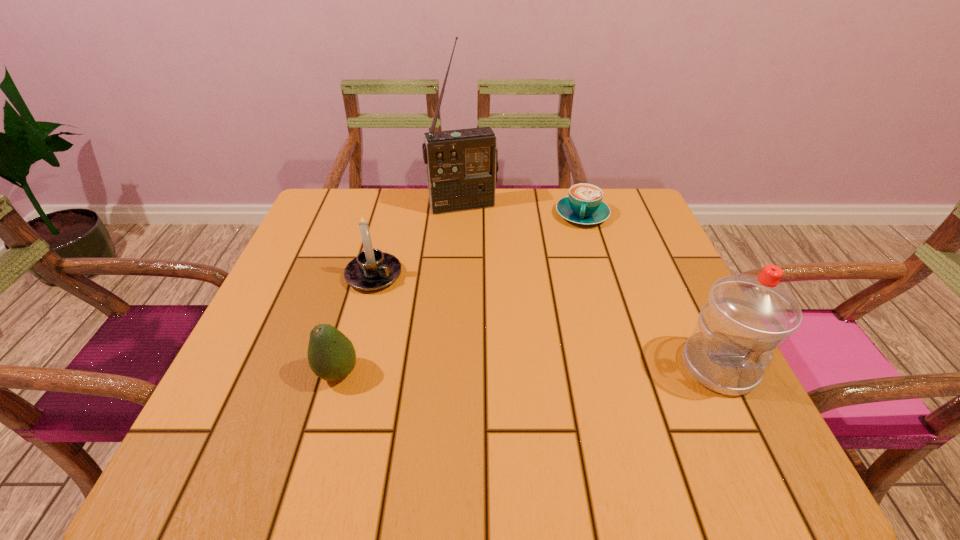
The width and height of the screenshot is (960, 540). In order to click on radio receiver that is at the far edge in this screenshot , I will do `click(462, 165)`.

Identify the location of avocado that is at the near edge. (331, 355).

The image size is (960, 540). Find the location of `water bottle located in the near edge section of the desktop`. water bottle located in the near edge section of the desktop is located at coordinates (746, 317).

Where is `avocado present at the left edge`? avocado present at the left edge is located at coordinates (331, 355).

At what (x,y) coordinates should I click in order to perform the action: click on candle holder present at the left edge. Please return your answer as a coordinate pair (x, y). This screenshot has width=960, height=540. Looking at the image, I should click on (372, 269).

Locate an element on the screen. water bottle located in the right edge section of the desktop is located at coordinates (746, 317).

Where is `cappuccino situated at the right edge`? cappuccino situated at the right edge is located at coordinates (584, 205).

Find the location of a particular element. The image size is (960, 540). object located in the near left corner section of the desktop is located at coordinates (331, 355).

Find the location of a particular element. object that is at the far right corner is located at coordinates (584, 205).

The width and height of the screenshot is (960, 540). I want to click on object positioned at the near right corner, so [746, 317].